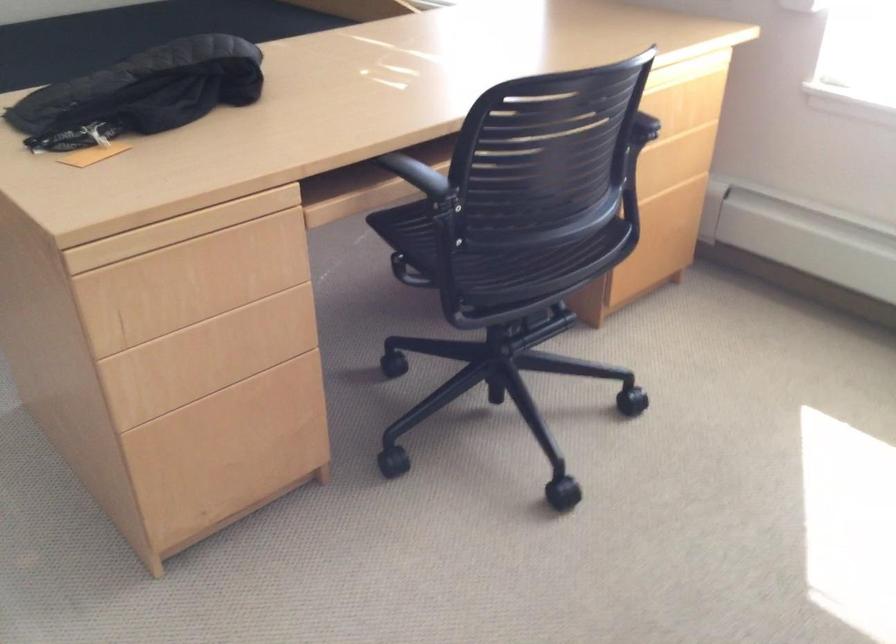
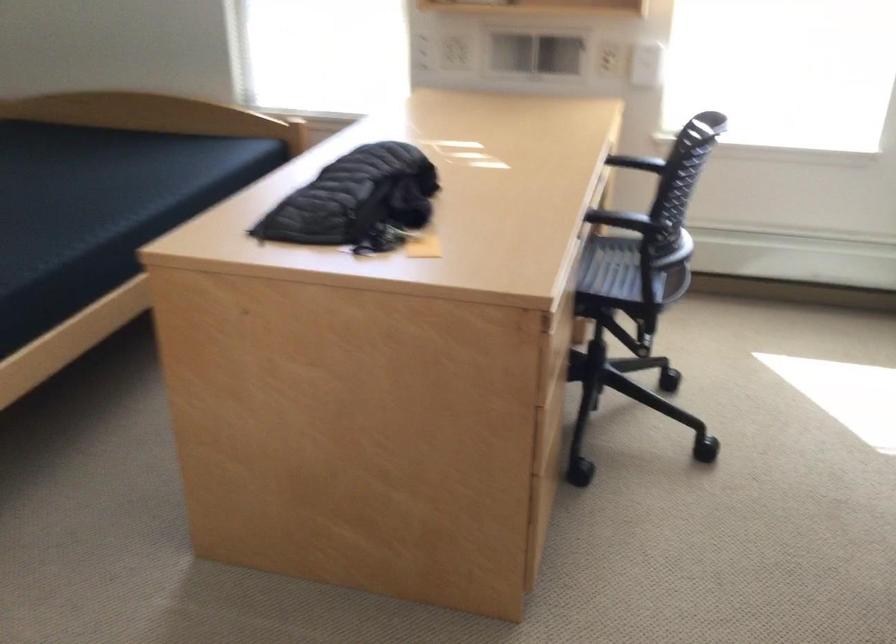
Find the pixel in the second image that matches point (389, 167) in the first image.

(597, 216)